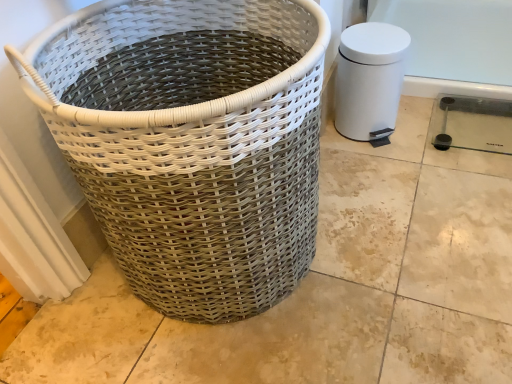
Find the location of a particular element. This screenshot has height=384, width=512. vacant area located to the right-hand side of white woven basket at left is located at coordinates (403, 237).